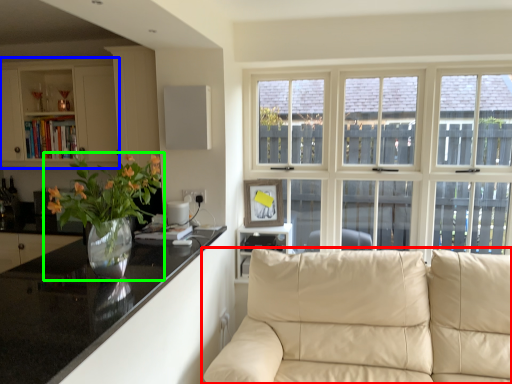
Question: Which is farther away from studio couch (highlighted by a red box)? cabinetry (highlighted by a blue box) or houseplant (highlighted by a green box)?

Choices:
 (A) cabinetry
 (B) houseplant

Answer: (A)